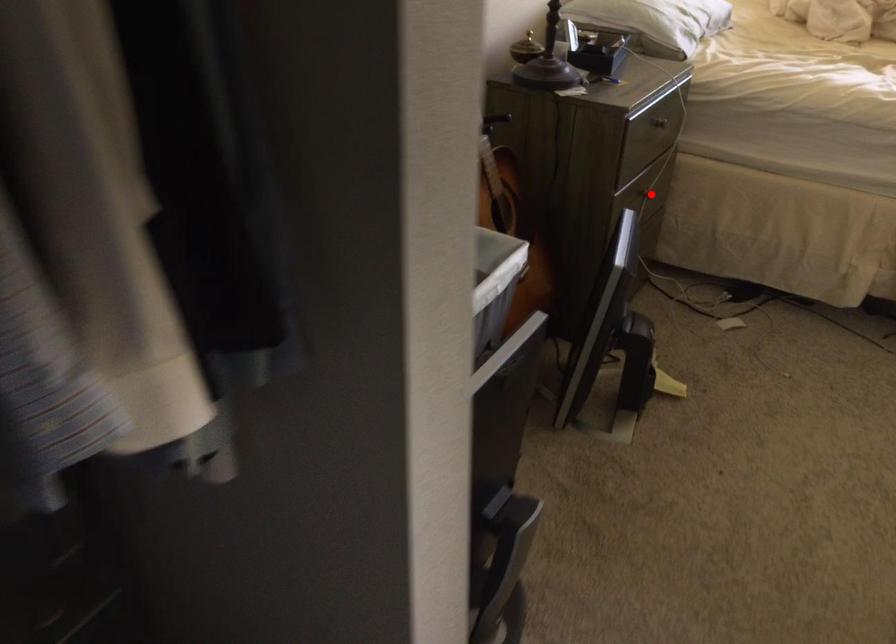
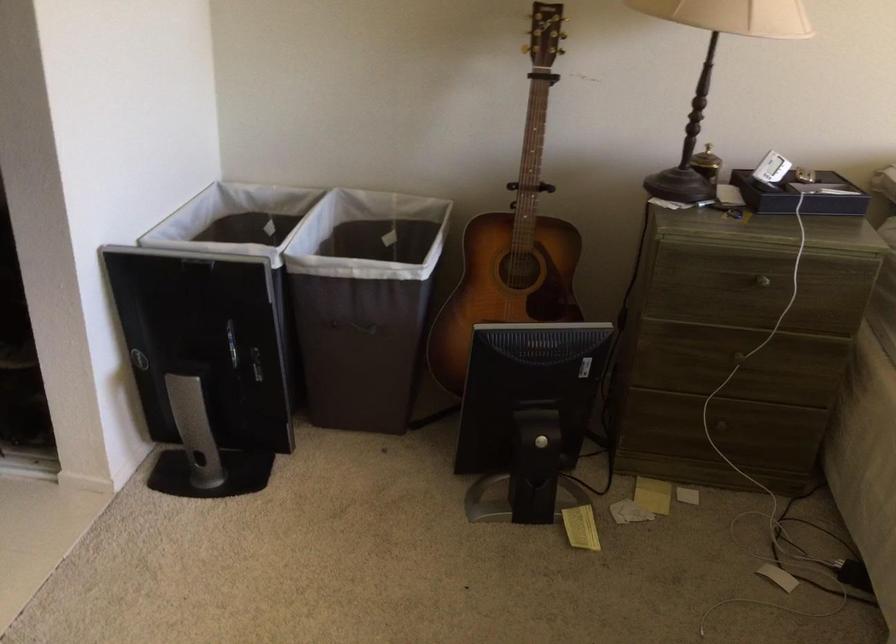
Question: I am providing you with two images of the same scene from different viewpoints. In image1, a red point is highlighted. Considering the same 3D point in image2, which of the following is correct?

Choices:
 (A) It is closer
 (B) It is farther

Answer: (A)